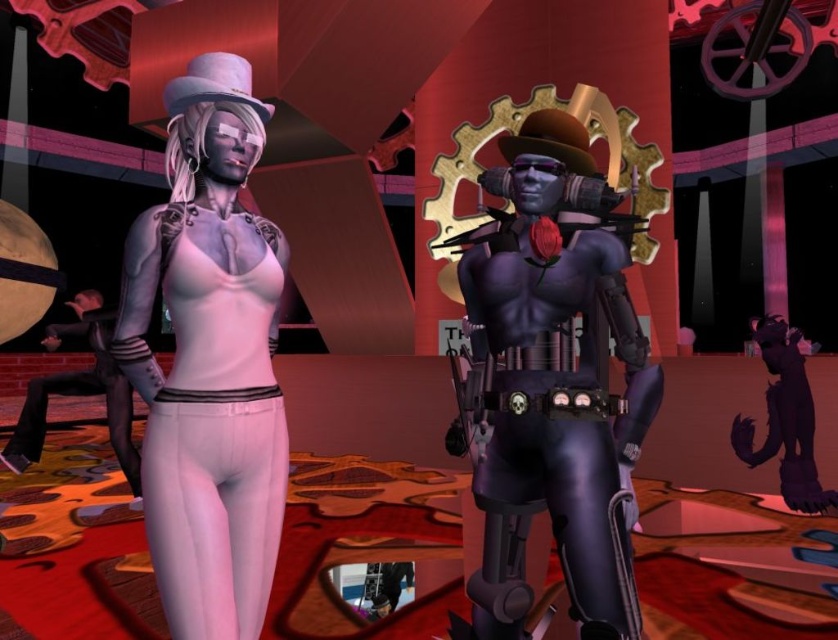
You are a game developer designing a virtual environment where the shiny purple armor at center and the matte white skin at left must be placed exactly 26.05 inches apart. Given that the minimum required distance between any two objects in this environment is 24 inches, does the current placement meet the safety requirements?

The shiny purple armor at center and the matte white skin at left are 26.05 inches apart, which exceeds the minimum required distance of 24 inches. Therefore, the current placement meets the safety requirements.